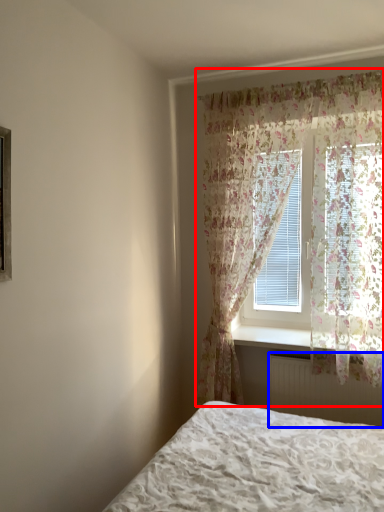
Question: Among these objects, which one is nearest to the camera, curtain (highlighted by a red box) or radiator (highlighted by a blue box)?

Choices:
 (A) curtain
 (B) radiator

Answer: (A)